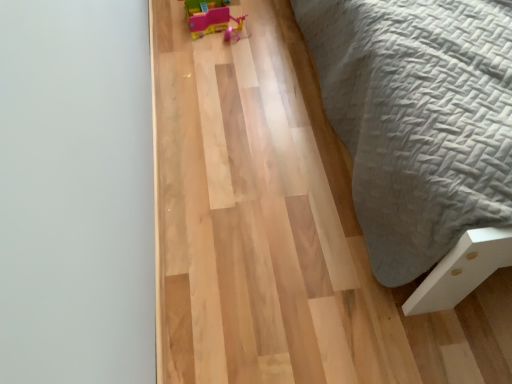
Question: Considering the relative sizes of natural wood floor at center and pink plastic toy at upper center in the image provided, is natural wood floor at center wider than pink plastic toy at upper center?

Choices:
 (A) no
 (B) yes

Answer: (B)

Question: Considering the relative sizes of natural wood floor at center and pink plastic toy at upper center in the image provided, is natural wood floor at center shorter than pink plastic toy at upper center?

Choices:
 (A) no
 (B) yes

Answer: (B)

Question: Is pink plastic toy at upper center surrounded by natural wood floor at center?

Choices:
 (A) yes
 (B) no

Answer: (B)

Question: Is natural wood floor at center thinner than pink plastic toy at upper center?

Choices:
 (A) yes
 (B) no

Answer: (B)

Question: From the image's perspective, is natural wood floor at center located beneath pink plastic toy at upper center?

Choices:
 (A) no
 (B) yes

Answer: (B)

Question: Does natural wood floor at center have a greater height compared to pink plastic toy at upper center?

Choices:
 (A) no
 (B) yes

Answer: (A)

Question: Is pink plastic toy at upper center turned away from natural wood floor at center?

Choices:
 (A) yes
 (B) no

Answer: (B)

Question: From the image's perspective, is pink plastic toy at upper center over natural wood floor at center?

Choices:
 (A) yes
 (B) no

Answer: (A)

Question: Is pink plastic toy at upper center smaller than natural wood floor at center?

Choices:
 (A) no
 (B) yes

Answer: (B)

Question: Can you confirm if pink plastic toy at upper center is positioned to the right of natural wood floor at center?

Choices:
 (A) yes
 (B) no

Answer: (B)

Question: From a real-world perspective, is pink plastic toy at upper center located beneath natural wood floor at center?

Choices:
 (A) no
 (B) yes

Answer: (A)

Question: Is pink plastic toy at upper center in contact with natural wood floor at center?

Choices:
 (A) yes
 (B) no

Answer: (B)

Question: Looking at the image, does pink plastic toy at upper center seem bigger or smaller compared to natural wood floor at center?

Choices:
 (A) big
 (B) small

Answer: (B)